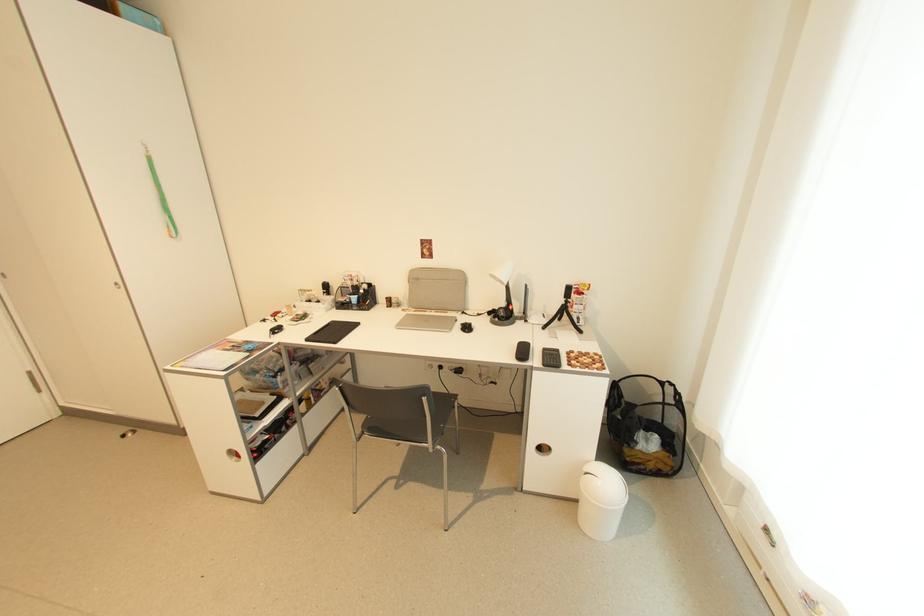
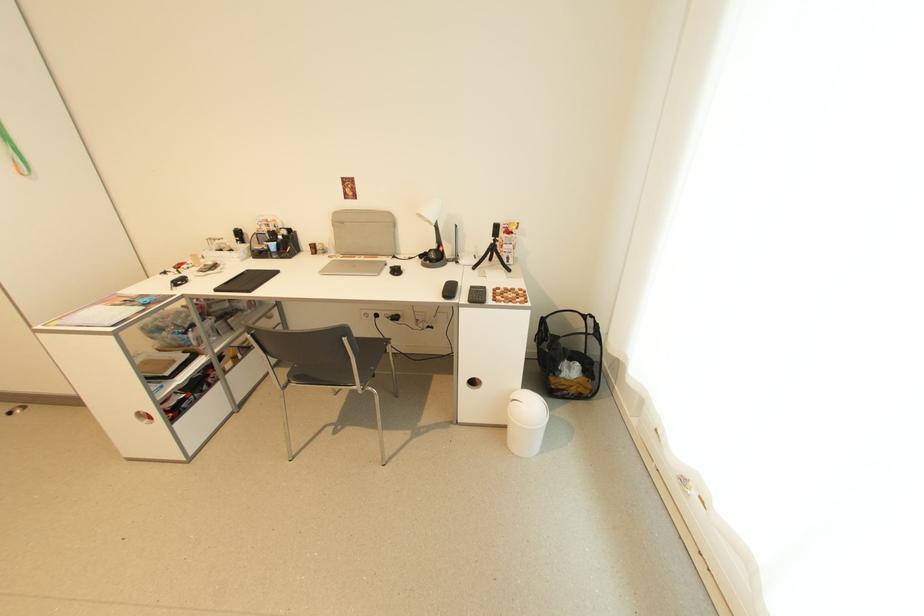
The point at (568, 299) is marked in the first image. Where is the corresponding point in the second image?

(497, 238)